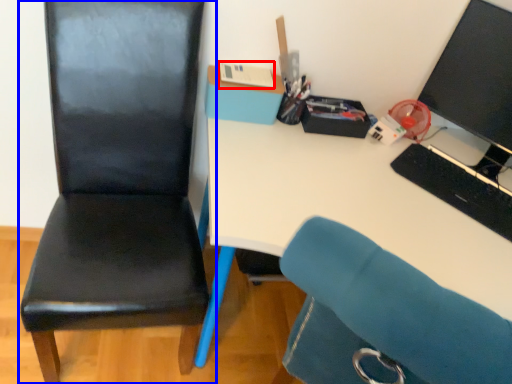
Question: Which object appears closest to the camera in this image, stationery (highlighted by a red box) or chair (highlighted by a blue box)?

Choices:
 (A) stationery
 (B) chair

Answer: (B)